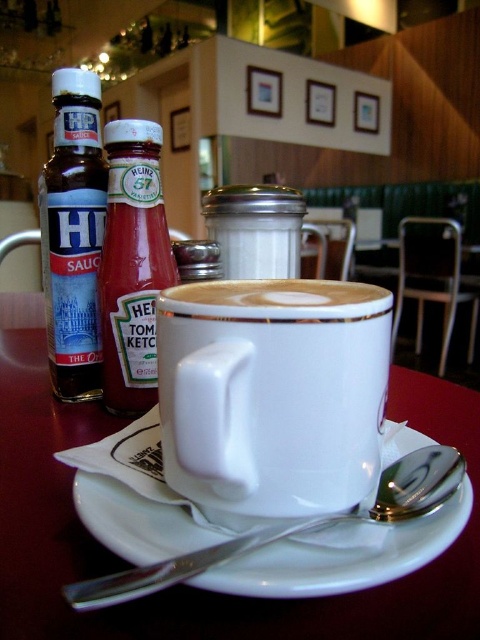
From the picture: You are a barista preparing a customer order. You need to place a large coffee cup and a small ketchup bottle on the table. Given the items on the table, can you confirm if the white ceramic mug at center can hold more liquid than the red glass bottle of ketchup at left?

The white ceramic mug at center has a larger size compared to the red glass bottle of ketchup at left, so yes, the white ceramic mug at center can hold more liquid than the red glass bottle of ketchup at left.

You are a barista preparing a drink and need to place both the white glossy mug at center and the red glass bottle of ketchup at left on a shelf. The shelf has a height limit of 10 cm. Can both items fit vertically on the shelf without exceeding the height limit?

The white glossy mug at center has a lesser height compared to the red glass bottle of ketchup at left. Since the shelf has a 10 cm height limit, both items can only fit if their individual heights are under 10 cm. However, the description only states their relative heights, not exact measurements. Therefore, it is impossible to determine if both will fit without knowing their specific heights.